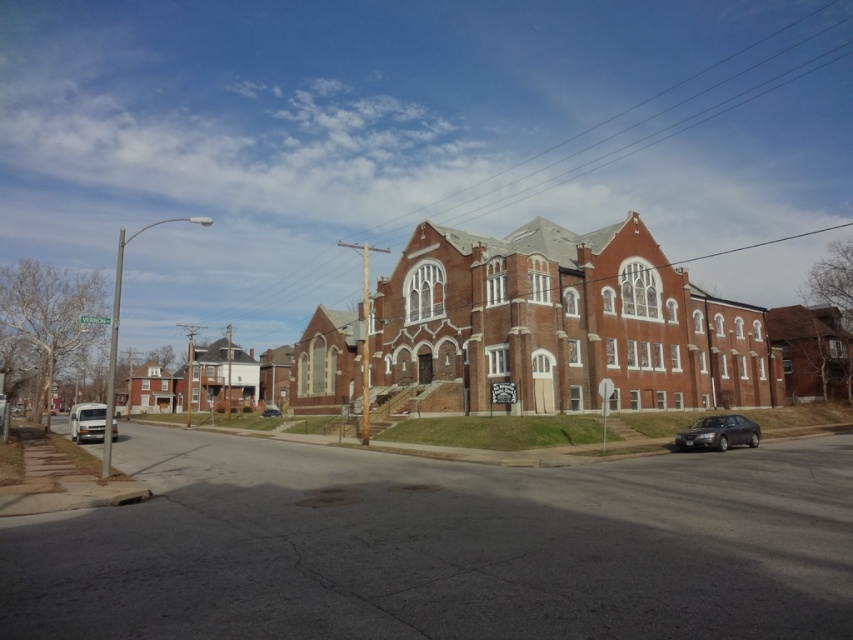
You are standing in front of the brick church at center. You want to take a photo of the entire building without any obstructions. Considering the distance between you and the church, what is the minimum focal length lens you should use to capture the entire structure in one frame?

To capture the entire brick church at center in one frame without obstructions, you need a lens with a focal length of at least 35mm. This ensures the camera can capture the full height and width of the building from a distance of 74.40 meters.

You are a delivery driver who needs to park your metallic silver car at center in a spot that can accommodate its width. Based on the scene, can you determine if the parking space in front of the brick church at center is wide enough?

The brick church at center might be wider than the metallic silver car at center, but without exact measurements of the parking space itself, it is uncertain whether the space is wide enough. You should check the marked lines or available space indicators on the street for confirmation.